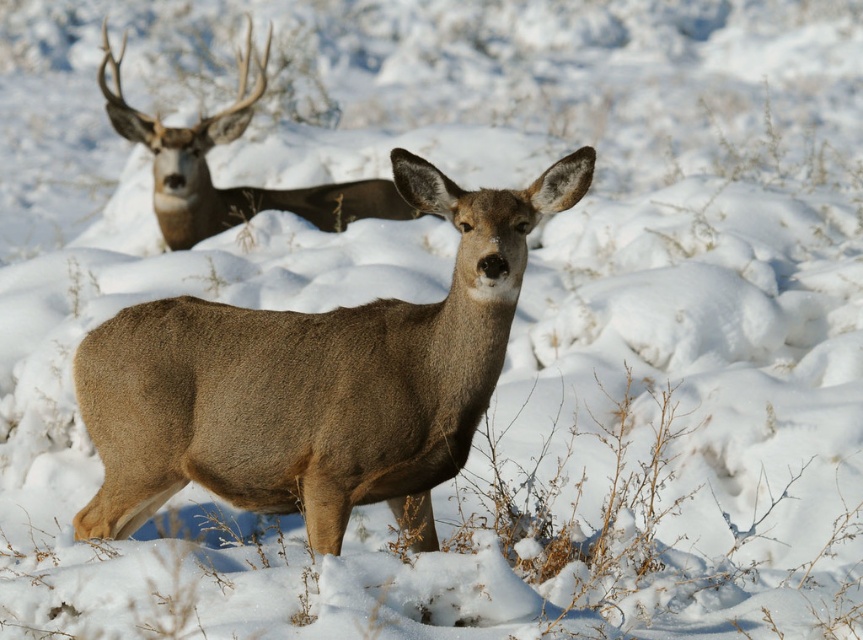
Between brown fur deer at center and brown velvet antlers at upper left, which one appears on the left side from the viewer's perspective?

Positioned to the left is brown velvet antlers at upper left.

Between brown fur deer at center and brown velvet antlers at upper left, which one is positioned higher?

brown velvet antlers at upper left is higher up.

At what (x,y) coordinates should I click in order to perform the action: click on brown fur deer at center. Please return your answer as a coordinate pair (x, y). Looking at the image, I should click on (315, 380).